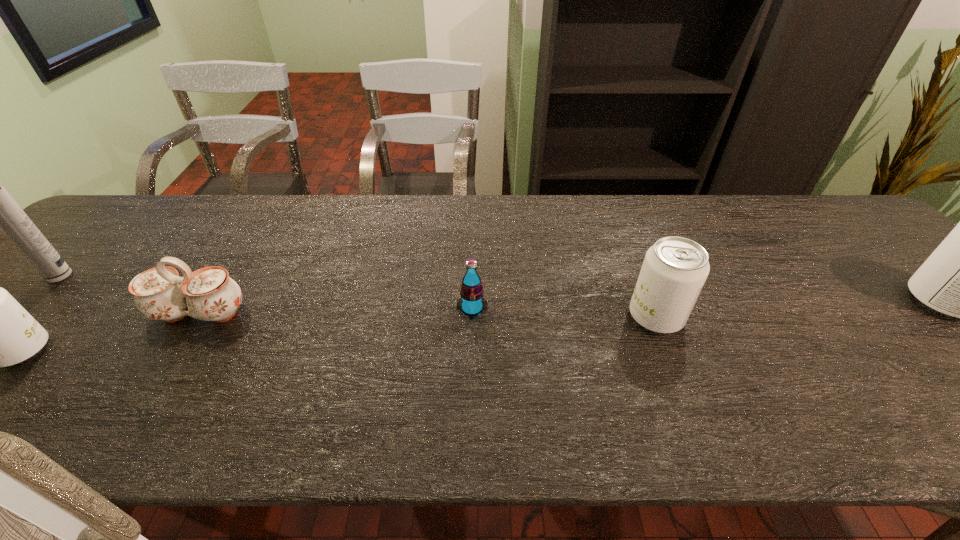
Find the location of a particular element. The height and width of the screenshot is (540, 960). object that is at the left edge is located at coordinates (0, 211).

Identify the location of free region at the far edge. Image resolution: width=960 pixels, height=540 pixels. coord(157,226).

The height and width of the screenshot is (540, 960). I want to click on vacant space at the near edge of the desktop, so click(564, 374).

Locate an element on the screen. The image size is (960, 540). vacant region at the left edge of the desktop is located at coordinates (90, 251).

Find the location of a particular element. This screenshot has height=540, width=960. vacant space at the right edge is located at coordinates (888, 303).

I want to click on vacant space at the far left corner of the desktop, so click(x=172, y=202).

Where is `empty location between the aerosol can and the third object from left to right`? Image resolution: width=960 pixels, height=540 pixels. empty location between the aerosol can and the third object from left to right is located at coordinates (130, 295).

The width and height of the screenshot is (960, 540). I want to click on vacant space in between the leftmost object and the third object from left to right, so click(130, 295).

You are a GUI agent. You are given a task and a screenshot of the screen. Output one action in this format:
    pyautogui.click(x=<x>, y=<y>)
    Task: Click on the vacant space that's between the second tallest soda and the fourth object from right to left
    This screenshot has width=960, height=540.
    Given the screenshot: What is the action you would take?
    pyautogui.click(x=428, y=315)

This screenshot has width=960, height=540. In order to click on free space between the fourth object from right to left and the second soda from right to left in this screenshot , I will do pos(428,315).